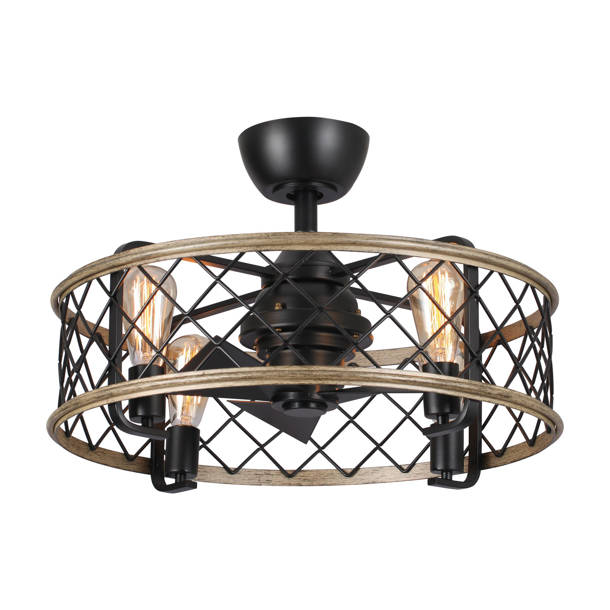
The image size is (610, 610). What are the coordinates of `fan blade` in the screenshot? It's located at (218, 386), (288, 426), (345, 393).